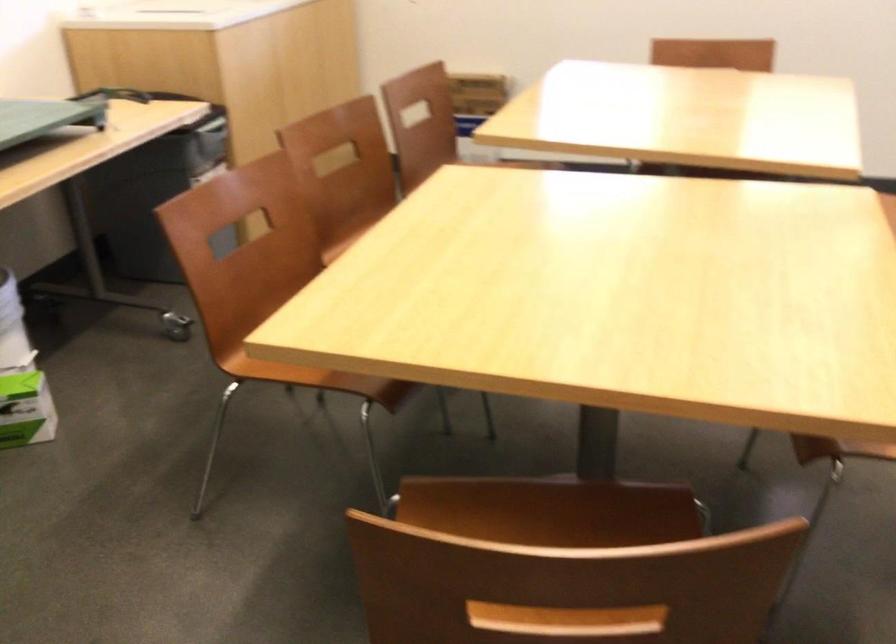
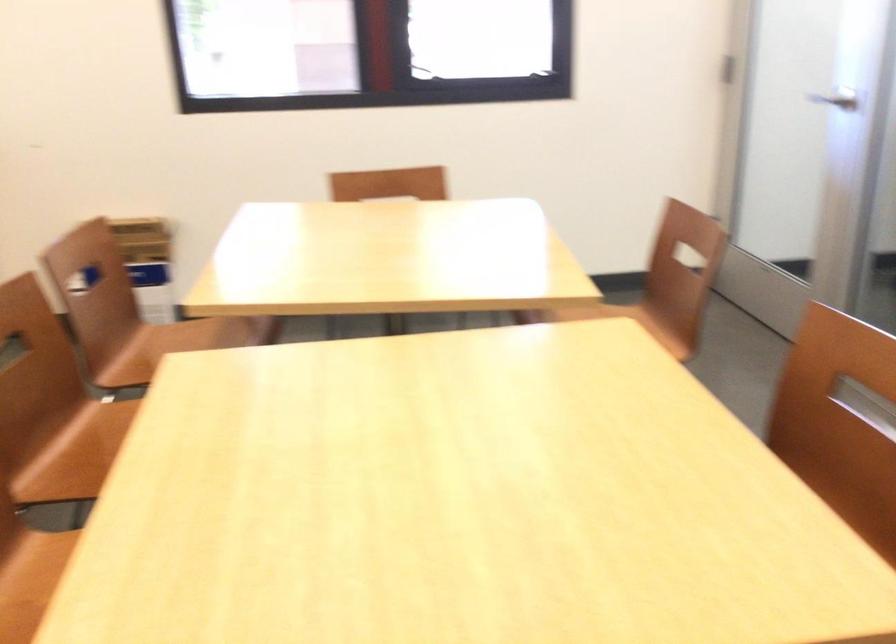
Question: Based on the continuous images, in which direction is the camera rotating? Reply with the corresponding letter.

Choices:
 (A) Left
 (B) Right
 (C) Up
 (D) Down

Answer: (B)